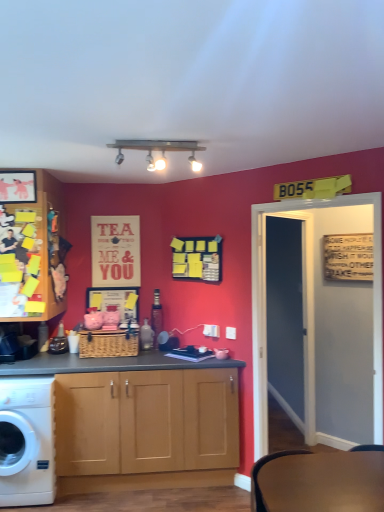
Question: Considering their positions, is wooden cabinet at left located in front of or behind woven brown picnic basket at center?

Choices:
 (A) behind
 (B) front

Answer: (B)

Question: Looking at their shapes, would you say wooden cabinet at left is wider or thinner than woven brown picnic basket at center?

Choices:
 (A) wide
 (B) thin

Answer: (A)

Question: Which of these objects is positioned farthest from the metallic track lighting at upper center?

Choices:
 (A) white plastic power outlet at center, arranged as the 2th power outlet when viewed from the back
 (B) white glossy washing machine at lower left
 (C) matte black picture frame at upper left
 (D) matte paper poster at upper center
 (E) wooden cabinet at left

Answer: (B)

Question: Estimate the real-world distances between objects in this image. Which object is farther from the white plastic power outlet at center, which is the 2th power outlet in left-to-right order?

Choices:
 (A) white plastic power outlet at center, marked as the 2th power outlet in a front-to-back arrangement
 (B) matte black picture frame at upper left
 (C) white glossy washing machine at lower left
 (D) wooden cabinet at left
 (E) matte paper poster at upper center

Answer: (B)